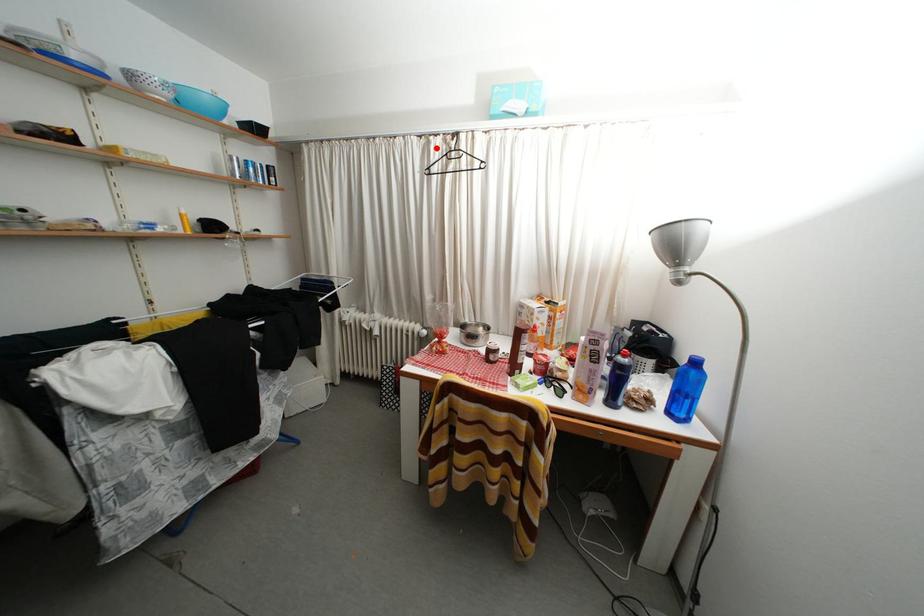
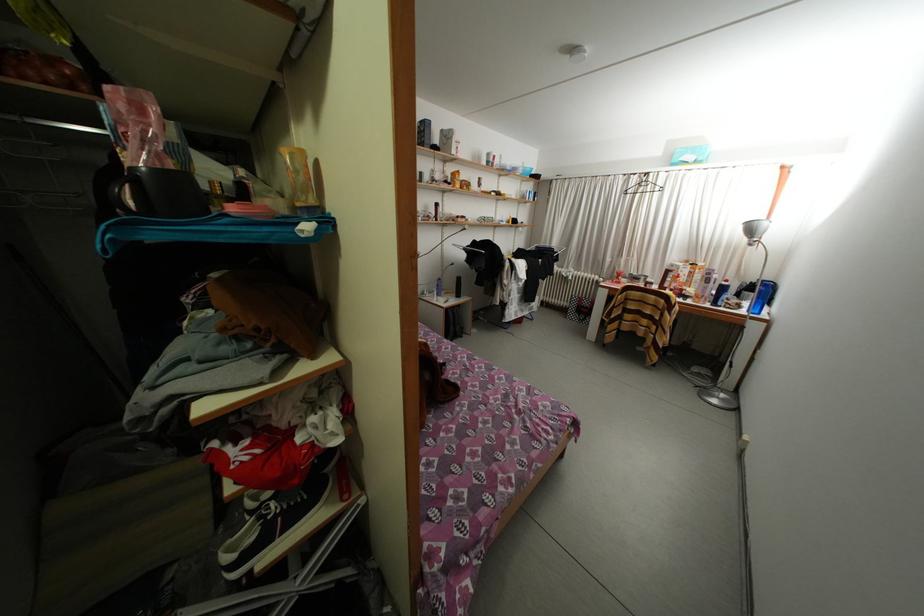
Where in the second image is the point corresponding to the highlighted location from the first image?

(638, 184)